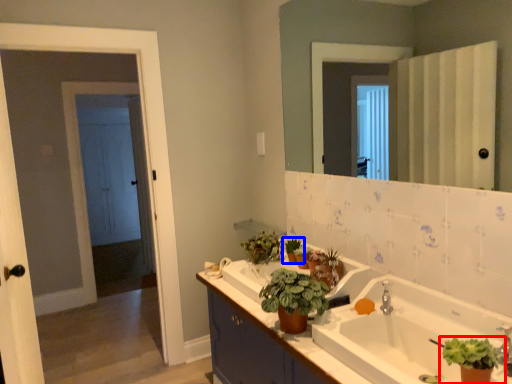
Question: Among these objects, which one is farthest to the camera, houseplant (highlighted by a red box) or houseplant (highlighted by a blue box)?

Choices:
 (A) houseplant
 (B) houseplant

Answer: (B)